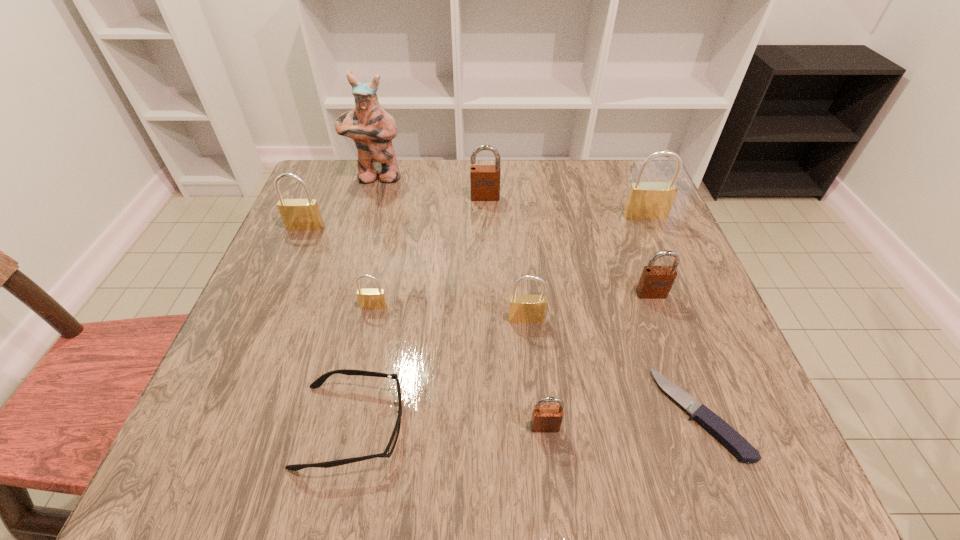
At what (x,y) coordinates should I click in order to perform the action: click on spectacles that is positioned at the near edge. Please return your answer as a coordinate pair (x, y). Image resolution: width=960 pixels, height=540 pixels. Looking at the image, I should click on (317, 383).

The image size is (960, 540). I want to click on steak knife that is at the near edge, so click(x=716, y=426).

In order to click on figurine located in the left edge section of the desktop in this screenshot , I will do `click(369, 125)`.

You are a GUI agent. You are given a task and a screenshot of the screen. Output one action in this format:
    pyautogui.click(x=<x>, y=<y>)
    Task: Click on the padlock located at the left edge
    The width and height of the screenshot is (960, 540).
    Given the screenshot: What is the action you would take?
    pyautogui.click(x=297, y=214)

This screenshot has width=960, height=540. Find the location of `steak knife present at the right edge`. steak knife present at the right edge is located at coordinates (716, 426).

Find the location of a particular element. object present at the far left corner is located at coordinates (369, 125).

Where is `object present at the far right corner`? Image resolution: width=960 pixels, height=540 pixels. object present at the far right corner is located at coordinates (646, 200).

Image resolution: width=960 pixels, height=540 pixels. Find the location of `object situated at the near right corner`. object situated at the near right corner is located at coordinates (716, 426).

Locate an element on the screen. The image size is (960, 540). free space at the far edge of the desktop is located at coordinates (446, 181).

Identify the location of vacant space at the near edge. The image size is (960, 540). (380, 448).